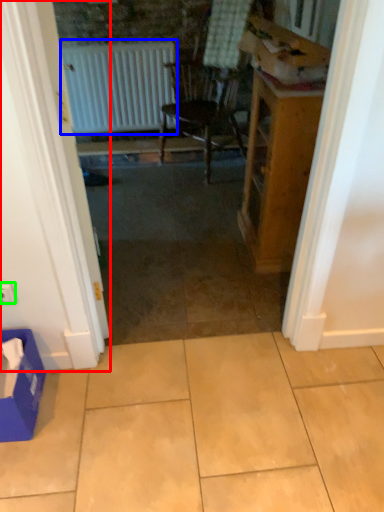
Question: Which object is the farthest from door (highlighted by a red box)? Choose among these: radiator (highlighted by a blue box) or electric outlet (highlighted by a green box).

Choices:
 (A) radiator
 (B) electric outlet

Answer: (A)